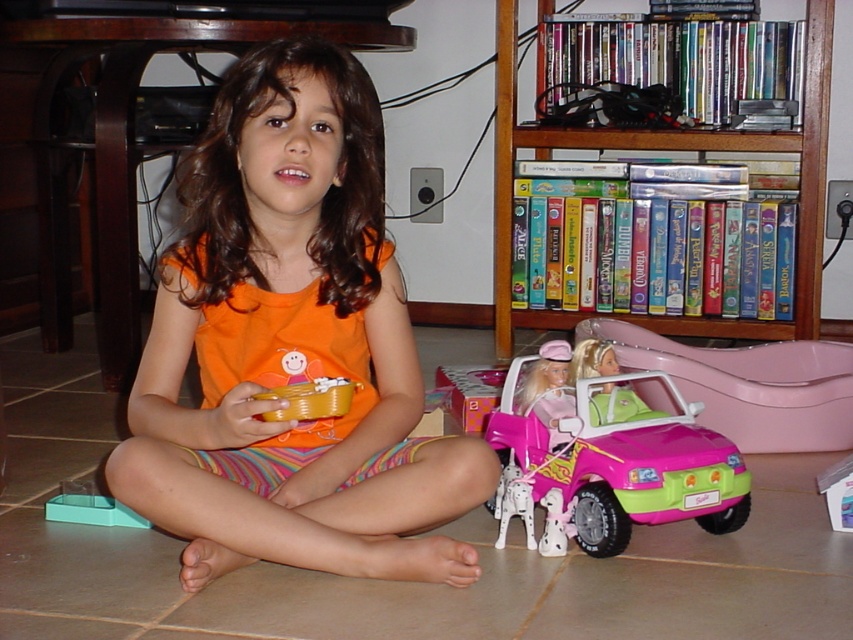
Question: Is orange cotton shirt at center smaller than pink plastic car at lower right?

Choices:
 (A) no
 (B) yes

Answer: (A)

Question: Is wooden bookshelf at upper right further to camera compared to pink plastic car at lower right?

Choices:
 (A) yes
 (B) no

Answer: (A)

Question: Which point is closer to the camera taking this photo?

Choices:
 (A) (611, 532)
 (B) (811, 273)

Answer: (A)

Question: Where is pink matte toy car at lower center located in relation to pink plastic car at lower right in the image?

Choices:
 (A) right
 (B) left

Answer: (B)

Question: Which point is closer to the camera?

Choices:
 (A) (260, 68)
 (B) (524, 147)

Answer: (A)

Question: Which point appears closest to the camera in this image?

Choices:
 (A) pyautogui.click(x=805, y=90)
 (B) pyautogui.click(x=618, y=484)
 (C) pyautogui.click(x=636, y=385)

Answer: (B)